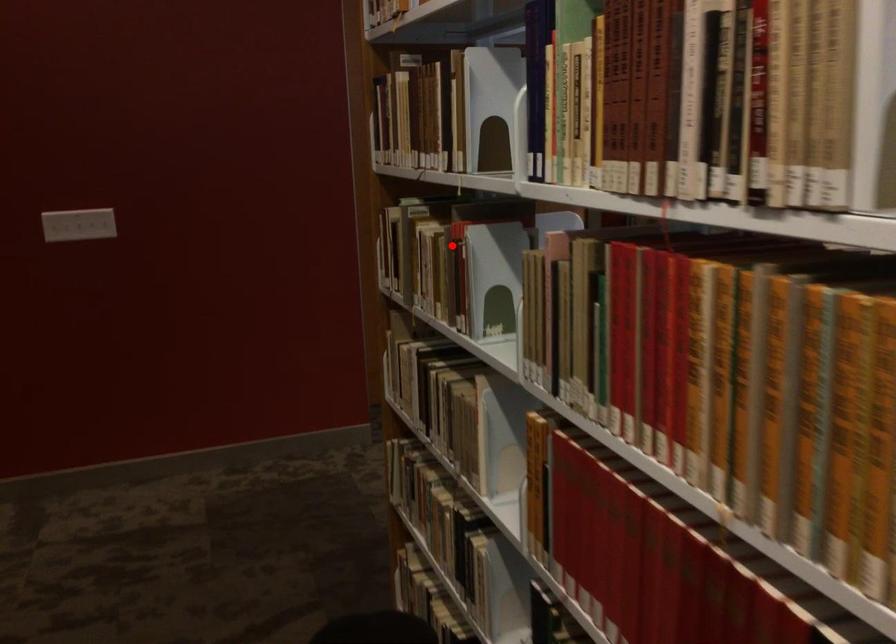
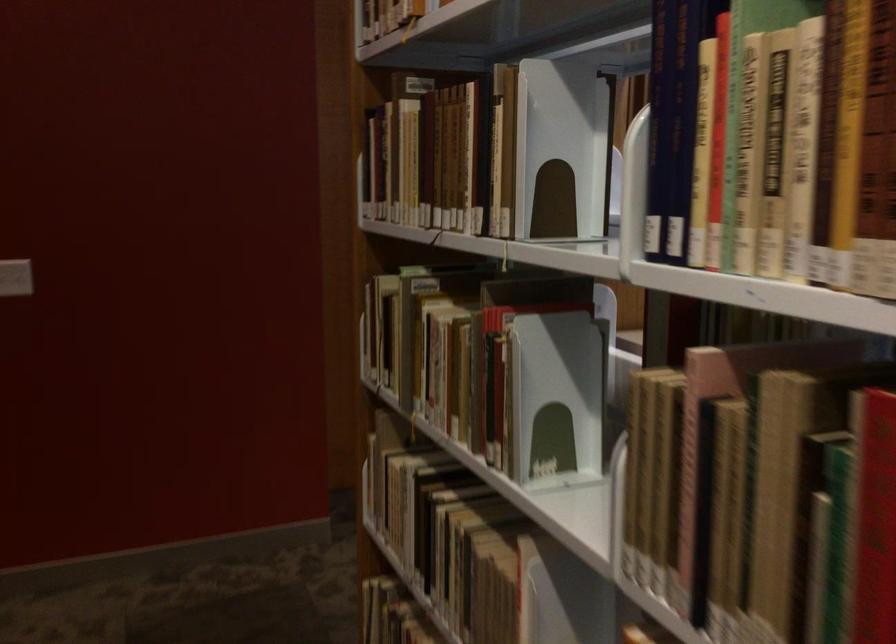
Find the pixel in the second image that matches the highlighted location in the first image.

(484, 342)